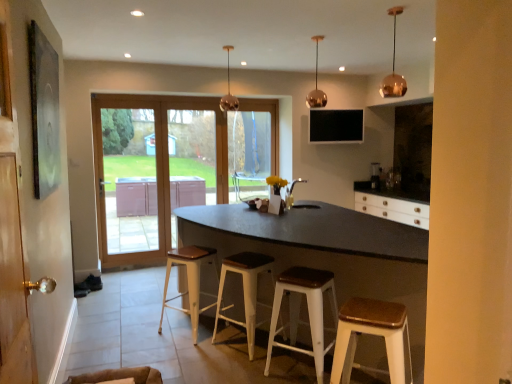
Image resolution: width=512 pixels, height=384 pixels. I want to click on blank space situated above gold metallic pendant light at upper center, arranged as the 2th light fixture when viewed from the right (from a real-world perspective), so click(x=320, y=36).